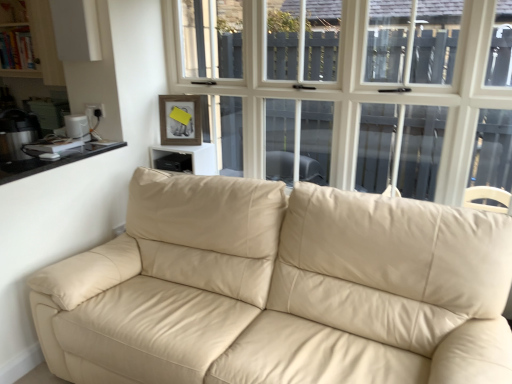
Question: From the image's perspective, is beige leather couch at center located above or below black glass counter top at left?

Choices:
 (A) below
 (B) above

Answer: (A)

Question: Is beige leather couch at center in front of or behind black glass counter top at left in the image?

Choices:
 (A) front
 (B) behind

Answer: (A)

Question: Based on their relative distances, which object is farther from the black glass counter top at left?

Choices:
 (A) white plastic toaster at left, which is the 1th appliance in right-to-left order
 (B) metallic silver kettle at left, arranged as the 1th appliance when viewed from the left
 (C) black plastic speaker at upper center
 (D) beige leather couch at center

Answer: (D)

Question: Which is nearer to the metallic silver kettle at left, the second appliance when ordered from right to left?

Choices:
 (A) black glass counter top at left
 (B) beige leather couch at center
 (C) white plastic toaster at left, the second appliance when ordered from left to right
 (D) black plastic speaker at upper center

Answer: (A)